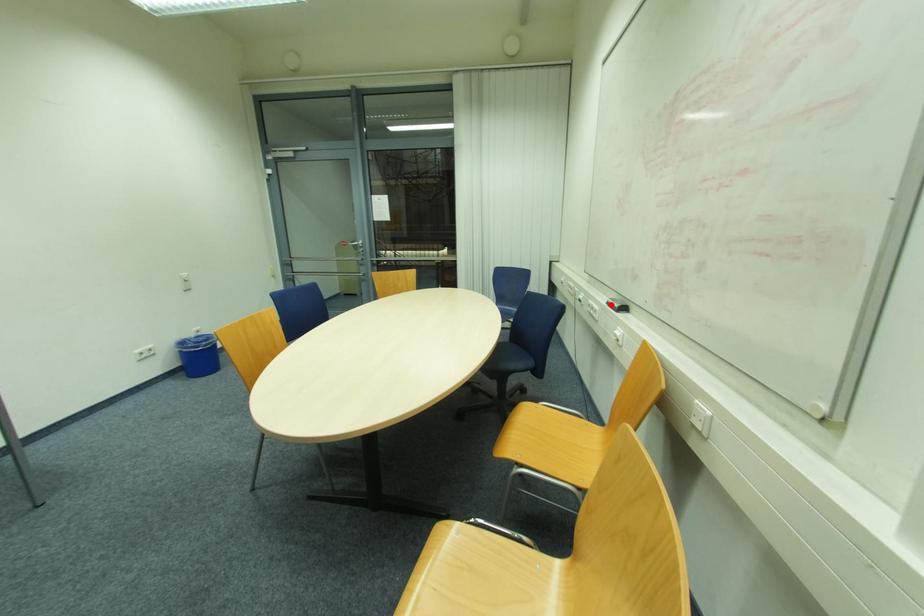
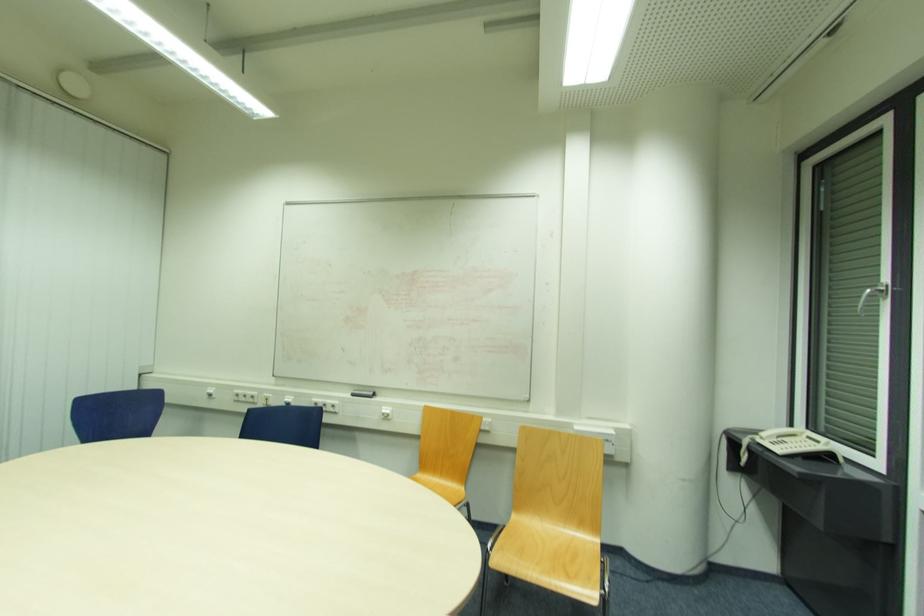
Locate, in the second image, the point that corresponds to the highlighted location in the first image.

(355, 395)